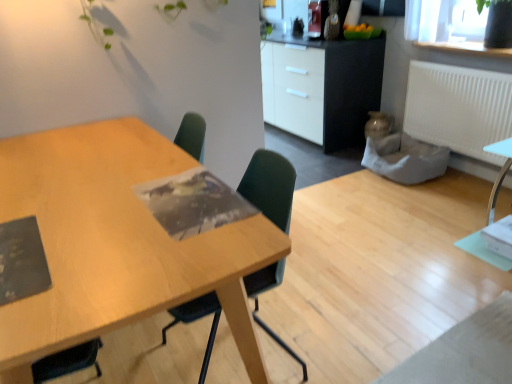
Question: Is white matte radiator at upper right not close to white glossy cabinet at upper center?

Choices:
 (A) yes
 (B) no

Answer: (B)

Question: Is white matte radiator at upper right further to the viewer compared to white glossy cabinet at upper center?

Choices:
 (A) no
 (B) yes

Answer: (A)

Question: Is white matte radiator at upper right shorter than white glossy cabinet at upper center?

Choices:
 (A) no
 (B) yes

Answer: (B)

Question: From a real-world perspective, is white matte radiator at upper right located higher than white glossy cabinet at upper center?

Choices:
 (A) yes
 (B) no

Answer: (A)

Question: Is white glossy cabinet at upper center at the back of white matte radiator at upper right?

Choices:
 (A) no
 (B) yes

Answer: (A)

Question: Does white matte radiator at upper right appear on the right side of white glossy cabinet at upper center?

Choices:
 (A) no
 (B) yes

Answer: (B)

Question: Is wooden table at center aimed at green plastic chair at center?

Choices:
 (A) no
 (B) yes

Answer: (B)

Question: Can you confirm if wooden table at center is thinner than green plastic chair at center?

Choices:
 (A) no
 (B) yes

Answer: (A)

Question: Can you confirm if wooden table at center is bigger than green plastic chair at center?

Choices:
 (A) no
 (B) yes

Answer: (B)

Question: Can you confirm if wooden table at center is smaller than green plastic chair at center?

Choices:
 (A) yes
 (B) no

Answer: (B)

Question: From a real-world perspective, is wooden table at center below green plastic chair at center?

Choices:
 (A) yes
 (B) no

Answer: (A)

Question: Is wooden table at center oriented away from green plastic chair at center?

Choices:
 (A) no
 (B) yes

Answer: (B)

Question: Is green plastic chair at center taller than white matte radiator at upper right?

Choices:
 (A) no
 (B) yes

Answer: (B)